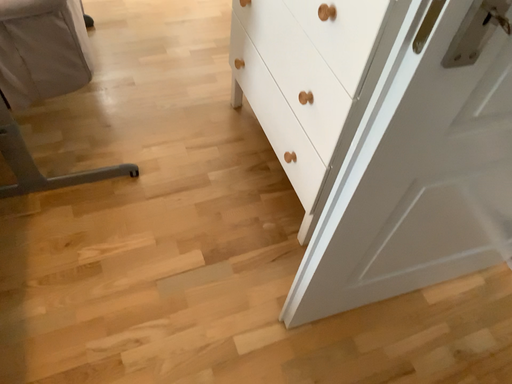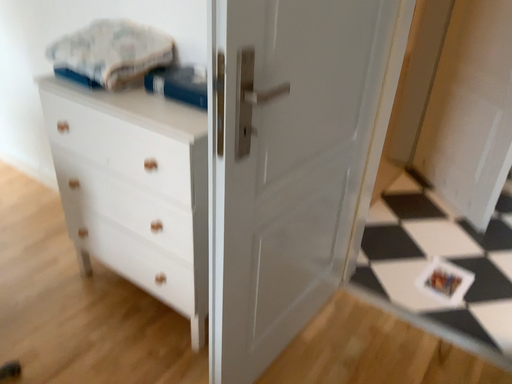
Question: Which way did the camera rotate in the video?

Choices:
 (A) rotated left
 (B) rotated right

Answer: (B)